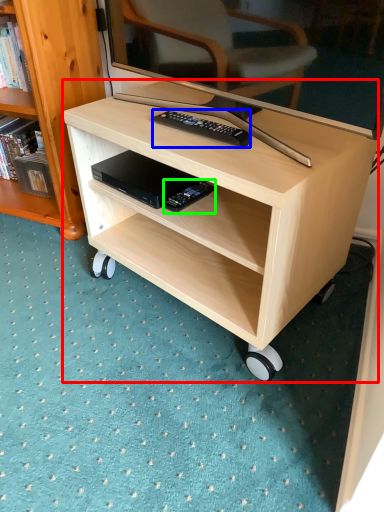
Question: Estimate the real-world distances between objects in this image. Which object is closer to desk (highlighted by a red box), remote control (highlighted by a blue box) or equipment (highlighted by a green box)?

Choices:
 (A) remote control
 (B) equipment

Answer: (A)